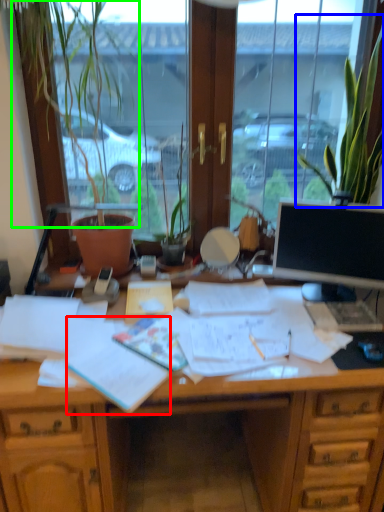
Question: Which object is positioned farthest from document (highlighted by a red box)? Select from houseplant (highlighted by a blue box) and plant (highlighted by a green box).

Choices:
 (A) houseplant
 (B) plant

Answer: (A)